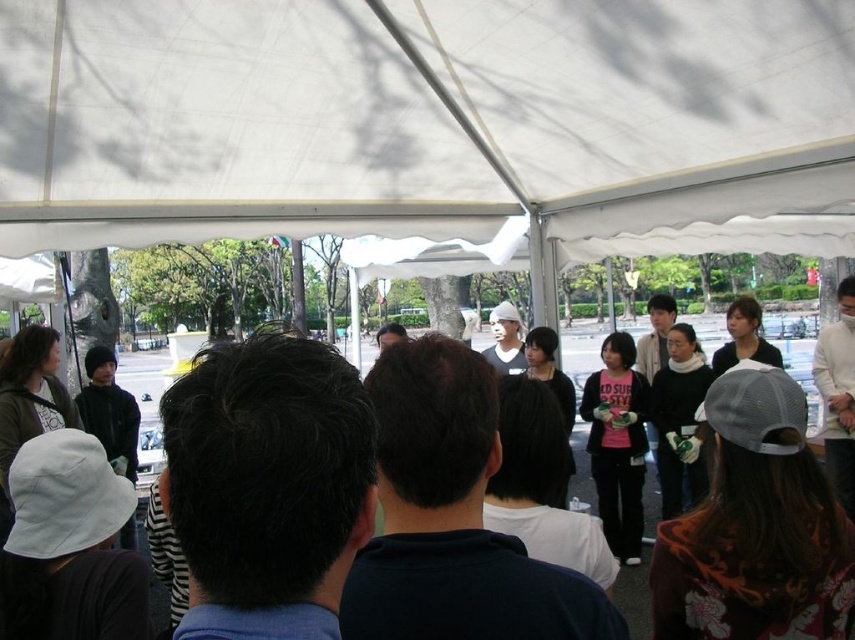
Question: Does white fabric canopy at upper center have a smaller size compared to matte black jacket at center?

Choices:
 (A) no
 (B) yes

Answer: (B)

Question: Which object appears closest to the camera in this image?

Choices:
 (A) matte black jacket at center
 (B) white fabric canopy at upper center

Answer: (B)

Question: Is white fabric canopy at upper center to the left of matte black jacket at center from the viewer's perspective?

Choices:
 (A) yes
 (B) no

Answer: (A)

Question: Is white fabric canopy at upper center to the right of matte black jacket at center from the viewer's perspective?

Choices:
 (A) no
 (B) yes

Answer: (A)

Question: Which of the following is the farthest from the observer?

Choices:
 (A) matte black jacket at center
 (B) white fabric canopy at upper center

Answer: (A)

Question: Which point is closer to the camera?

Choices:
 (A) (145, 477)
 (B) (785, 184)

Answer: (B)